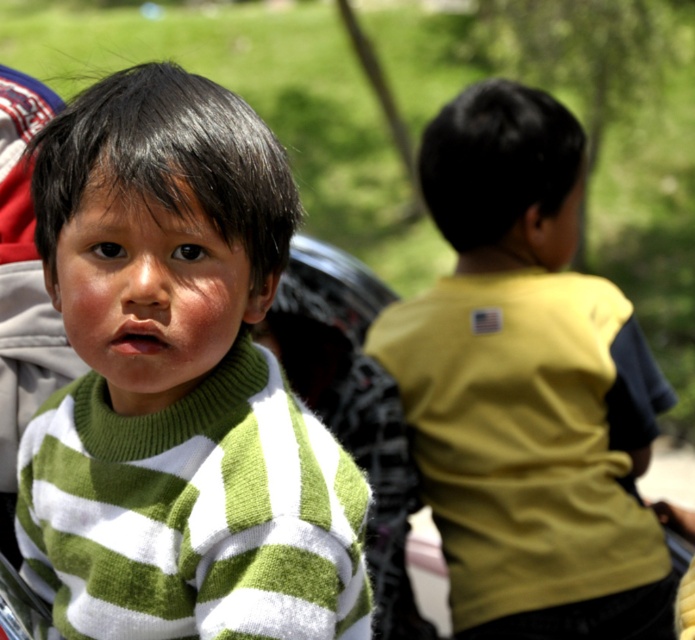
You are a photographer trying to capture both children in focus. Given that the green striped sweater at center is closer to you than the yellow matte shirt at right, which child should you adjust your camera focus to prioritize to ensure both are in focus?

To ensure both the green striped sweater at center and the yellow matte shirt at right are in focus, you should adjust your camera focus to prioritize the green striped sweater at center since it is closer to you. This will help maintain sharpness for both subjects as depth of field typically extends beyond the point of focus.

You are a photographer trying to adjust your camera to focus on the green striped sweater at center. According to the coordinates provided, where exactly should you position your camera focus point?

The green striped sweater at center is located at the 2D coordinates point [179,384], so you should position your camera focus point at that exact coordinate to ensure the sweater is in sharp focus.

You are a photographer trying to capture a clear shot of both the green striped sweater at center and the yellow matte shirt at right. Given their current positions, which one is closer to the camera?

The green striped sweater at center is closer to the camera because it is positioned over the yellow matte shirt at right, indicating it is in front.